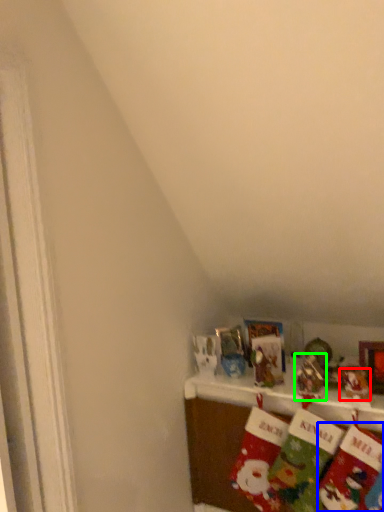
Question: Which object is the farthest from toy (highlighted by a red box)? Choose among these: sock (highlighted by a blue box) or toy (highlighted by a green box).

Choices:
 (A) sock
 (B) toy

Answer: (A)